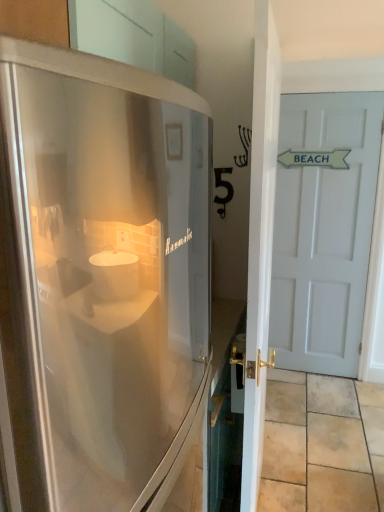
Question: Does white glossy door at right, which is the 2th door from back to front, lie in front of beige stone tile at lower right?

Choices:
 (A) yes
 (B) no

Answer: (A)

Question: Are white glossy door at right, the first door positioned from the left, and beige stone tile at lower right beside each other?

Choices:
 (A) no
 (B) yes

Answer: (A)

Question: Can you confirm if white glossy door at right, the first door when ordered from front to back, is bigger than beige stone tile at lower right?

Choices:
 (A) no
 (B) yes

Answer: (B)

Question: Is beige stone tile at lower right located within white glossy door at right, which is the 2th door from back to front?

Choices:
 (A) no
 (B) yes

Answer: (A)

Question: Is beige stone tile at lower right at the back of white glossy door at right, the first door when ordered from front to back?

Choices:
 (A) yes
 (B) no

Answer: (B)

Question: Would you say white glossy door at right, the first door positioned from the left, is inside or outside stainless steel refrigerator at left?

Choices:
 (A) outside
 (B) inside

Answer: (A)

Question: From the image's perspective, is white glossy door at right, which appears as the second door when viewed from the right, above or below stainless steel refrigerator at left?

Choices:
 (A) below
 (B) above

Answer: (B)

Question: Based on their positions, is white glossy door at right, the first door positioned from the left, located to the left or right of stainless steel refrigerator at left?

Choices:
 (A) right
 (B) left

Answer: (A)

Question: Is white glossy door at right, which appears as the second door when viewed from the right, wider or thinner than stainless steel refrigerator at left?

Choices:
 (A) wide
 (B) thin

Answer: (B)

Question: From a real-world perspective, is beige stone tile at lower right positioned above or below stainless steel refrigerator at left?

Choices:
 (A) above
 (B) below

Answer: (B)

Question: Does point (362, 410) appear closer or farther from the camera than point (34, 248)?

Choices:
 (A) closer
 (B) farther

Answer: (B)

Question: Is beige stone tile at lower right wider or thinner than stainless steel refrigerator at left?

Choices:
 (A) wide
 (B) thin

Answer: (A)

Question: From the image's perspective, is beige stone tile at lower right located above or below stainless steel refrigerator at left?

Choices:
 (A) below
 (B) above

Answer: (A)

Question: From a real-world perspective, relative to white glossy door at right, the first door when ordered from front to back, is stainless steel refrigerator at left vertically above or below?

Choices:
 (A) below
 (B) above

Answer: (B)

Question: Relative to white glossy door at right, the first door positioned from the left, is stainless steel refrigerator at left in front or behind?

Choices:
 (A) front
 (B) behind

Answer: (A)